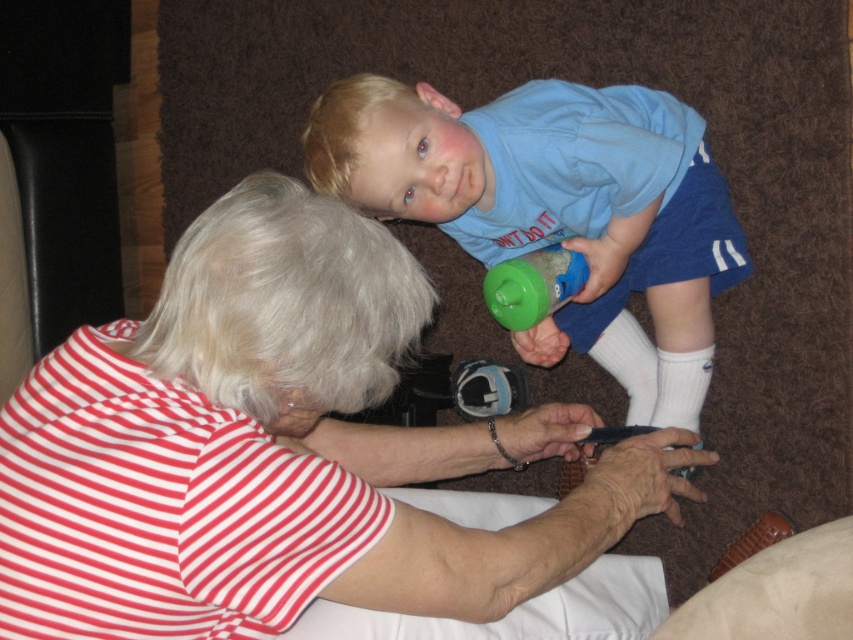
You are a photographer trying to capture a candid shot of the striped cotton shirt at center and the green plastic sippy cup at center. Since you want both items to be clearly visible in the frame, which object should you position closer to the camera to ensure both are in focus?

The striped cotton shirt at center is to the left of green plastic sippy cup at center. To ensure both are in focus, position the striped cotton shirt at center closer to the camera since it is already positioned to the left, allowing the depth of field to cover both objects effectively.

Based on the scene description, which clothing item is shorter in height between the striped cotton shirt at center and the blue cotton shirt at upper center?

The striped cotton shirt at center is shorter in height than the blue cotton shirt at upper center.